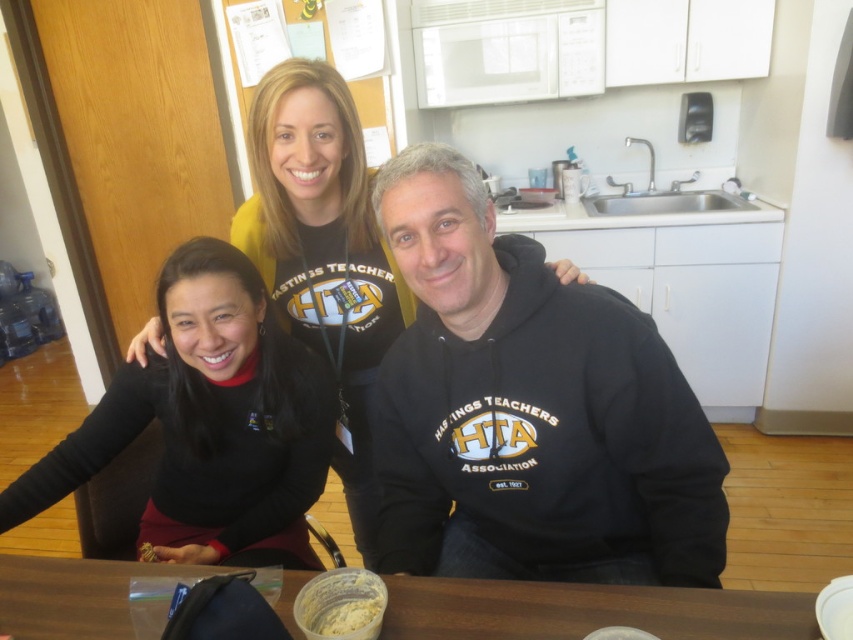
Looking at this image, you are a photographer trying to capture a group photo of the three people at the table. Since you want to include both the black matte shirt at center and the brown wooden table at lower center in the frame, which object should you position closer to the camera to ensure both are visible?

The black matte shirt at center is to the left of the brown wooden table at lower center, so positioning the camera closer to the brown wooden table at lower center would help ensure both objects are in the frame.

You are trying to decide whether to place a new decorative item on the brown wooden table at lower center. Considering the size of the black matte shirt at center, will the table be able to accommodate the item without overcrowding?

The black matte shirt at center is bigger than brown wooden table at lower center, so placing a new decorative item might overcrowd the table since the shirt already occupies more space than the table can handle.